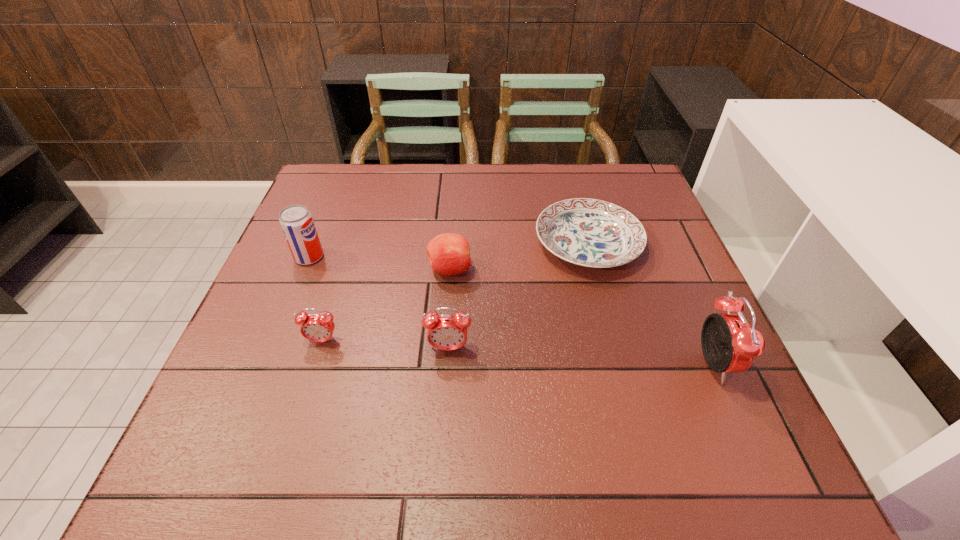
Find the location of a particular element. The width and height of the screenshot is (960, 540). the fifth object from right to left is located at coordinates (315, 327).

You are a GUI agent. You are given a task and a screenshot of the screen. Output one action in this format:
    pyautogui.click(x=<x>, y=<y>)
    Task: Click on the shortest alarm clock
    
    Given the screenshot: What is the action you would take?
    pyautogui.click(x=315, y=327)

The height and width of the screenshot is (540, 960). I want to click on the second shortest alarm clock, so click(x=445, y=332).

Where is `the tallest object`? the tallest object is located at coordinates (729, 344).

Image resolution: width=960 pixels, height=540 pixels. I want to click on the rightmost alarm clock, so click(x=729, y=344).

At what (x,y) coordinates should I click in order to perform the action: click on apple. Please return your answer as a coordinate pair (x, y). Image resolution: width=960 pixels, height=540 pixels. Looking at the image, I should click on (449, 254).

Locate an element on the screen. The height and width of the screenshot is (540, 960). plate is located at coordinates (588, 232).

Identify the location of the second object from right to left. (588, 232).

Where is `the leftmost object`? The width and height of the screenshot is (960, 540). the leftmost object is located at coordinates (296, 221).

Where is `free region located on the face of the fifth object from right to left`? The width and height of the screenshot is (960, 540). free region located on the face of the fifth object from right to left is located at coordinates (305, 395).